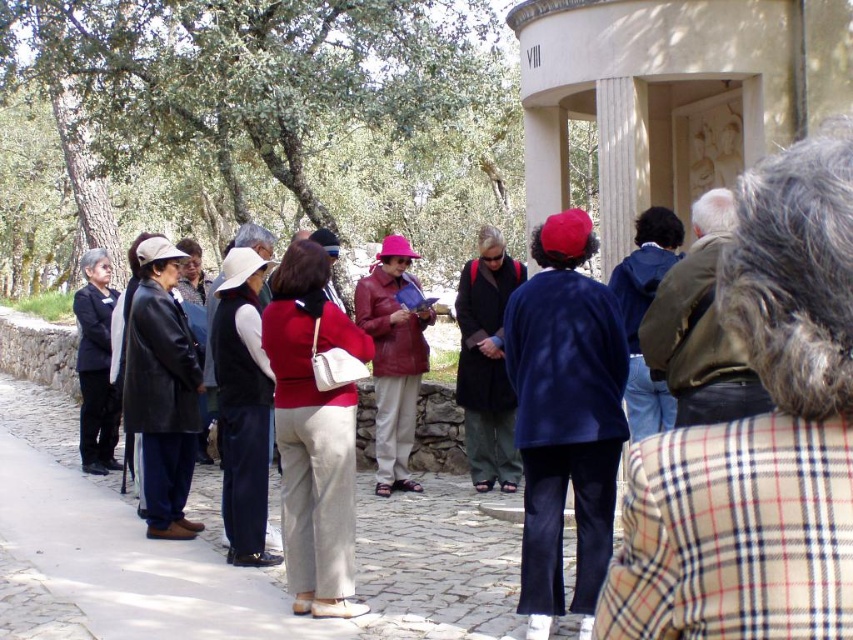
Question: Considering the relative positions of plaid fabric jacket at center and navy blue fabric jacket at center in the image provided, where is plaid fabric jacket at center located with respect to navy blue fabric jacket at center?

Choices:
 (A) above
 (B) below

Answer: (A)

Question: Among these points, which one is nearest to the camera?

Choices:
 (A) (426, 364)
 (B) (88, 113)

Answer: (A)

Question: Considering the real-world distances, which object is farthest from the black leather jacket at left?

Choices:
 (A) matte black coat at left
 (B) navy blue fabric jacket at center
 (C) matte leather jacket at center

Answer: (B)

Question: Is matte black coat at left below black leather jacket at left?

Choices:
 (A) yes
 (B) no

Answer: (B)

Question: Which point is farther from the camera taking this photo?

Choices:
 (A) (108, 360)
 (B) (383, 410)
 (C) (131, 248)
 (D) (248, 124)

Answer: (D)

Question: Is navy blue fabric jacket at center below matte black coat at left?

Choices:
 (A) no
 (B) yes

Answer: (B)